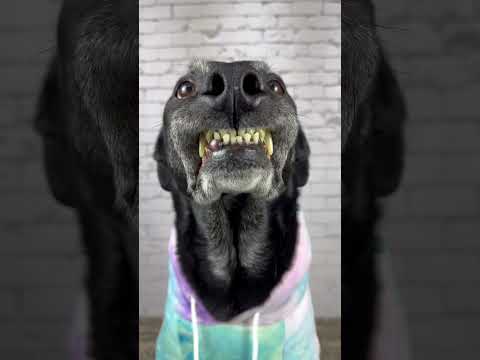
This screenshot has width=480, height=360. Find the location of `hood`. hood is located at coordinates (302, 258), (170, 241).